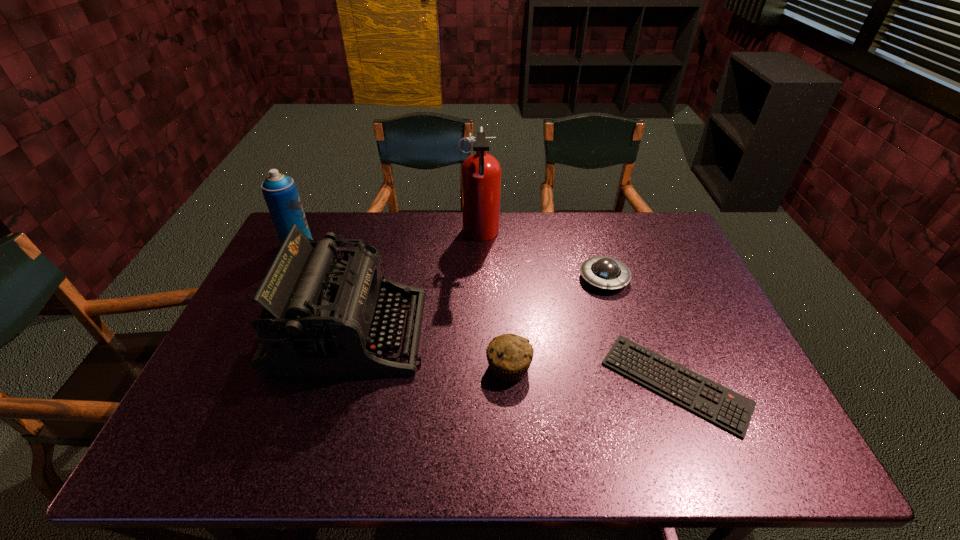
Where is `the tallest object`? The width and height of the screenshot is (960, 540). the tallest object is located at coordinates (480, 173).

Locate an element on the screen. the leftmost object is located at coordinates point(280,192).

Locate an element on the screen. The image size is (960, 540). the second object from left to right is located at coordinates (321, 315).

Find the location of a particular element. The height and width of the screenshot is (540, 960). muffin is located at coordinates (509, 356).

The width and height of the screenshot is (960, 540). I want to click on saucer, so click(605, 272).

I want to click on the shortest object, so click(731, 411).

Locate an element on the screen. Image resolution: width=960 pixels, height=540 pixels. free space located on the right of the fire extinguisher is located at coordinates (532, 234).

What are the coordinates of `free space located 0.170m on the front of the leftmost object` in the screenshot? It's located at (276, 292).

Find the location of a particular element. The image size is (960, 540). free region located on the keyboard of the typewriter is located at coordinates pyautogui.click(x=560, y=332).

In order to click on blank area located on the right of the muffin in this screenshot , I will do `click(620, 367)`.